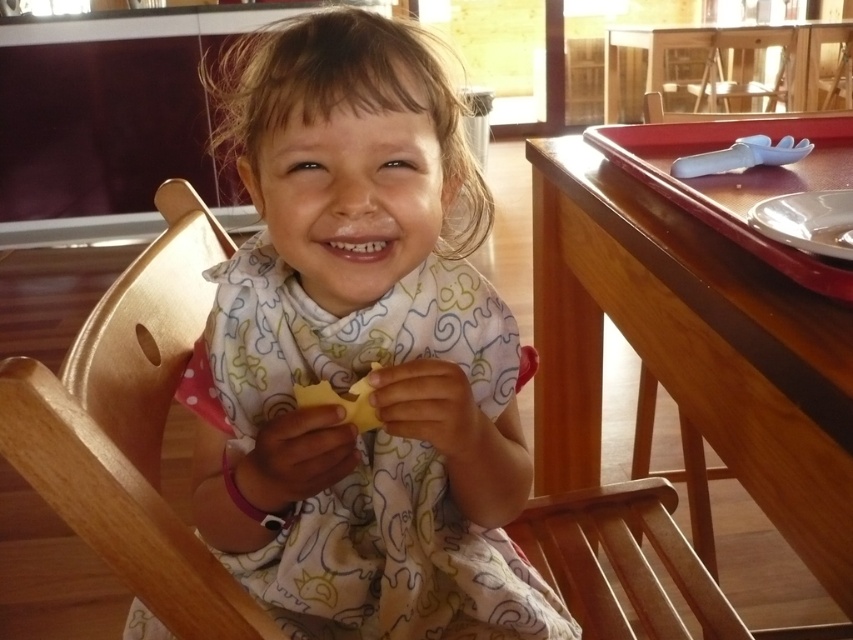
Is white printed bib at center to the right of wooden table at right from the viewer's perspective?

Incorrect, white printed bib at center is not on the right side of wooden table at right.

Is white printed bib at center positioned before wooden table at right?

No, it is not.

Is point (427, 324) positioned before point (753, 484)?

No.

Find the location of a particular element. white printed bib at center is located at coordinates point(363,349).

Who is more forward, (648, 577) or (358, 432)?

Point (358, 432) is in front.

Is wooden chair at lower center thinner than yellow rubbery cheese at center?

No.

The image size is (853, 640). What do you see at coordinates (621, 561) in the screenshot?
I see `wooden chair at lower center` at bounding box center [621, 561].

Locate an element on the screen. The width and height of the screenshot is (853, 640). wooden chair at lower center is located at coordinates (621, 561).

Is wooden table at right wider than wooden chair at lower center?

Indeed, wooden table at right has a greater width compared to wooden chair at lower center.

Does wooden table at right appear on the right side of wooden chair at lower center?

Yes, wooden table at right is to the right of wooden chair at lower center.

Between point (735, 445) and point (573, 609), which one is positioned in front?

Point (735, 445)

The height and width of the screenshot is (640, 853). I want to click on wooden table at right, so click(689, 348).